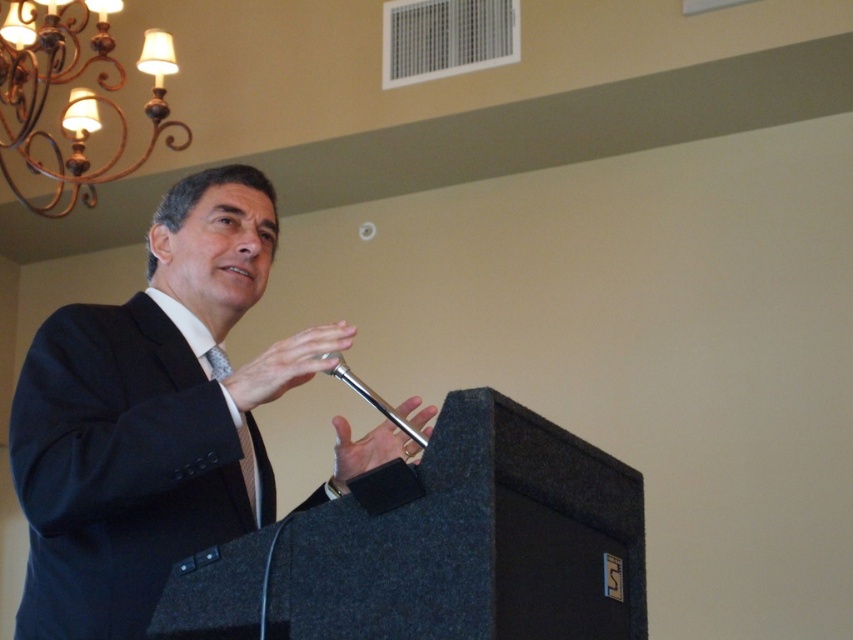
Does black suit at center have a greater height compared to gold wrought iron chandelier at upper left?

No, black suit at center is not taller than gold wrought iron chandelier at upper left.

Who is more forward, (39,540) or (190,131)?

Point (39,540)

Measure the distance between black suit at center and camera.

black suit at center is 5.14 feet from camera.

Where is `black suit at center`? The image size is (853, 640). black suit at center is located at coordinates (149, 416).

Does gold wrought iron chandelier at upper left lie in front of silver metallic microphone at center?

No.

Between point (32, 104) and point (347, 376), which one is positioned in front?

Point (347, 376) is in front.

At what (x,y) coordinates should I click in order to perform the action: click on gold wrought iron chandelier at upper left. Please return your answer as a coordinate pair (x, y). Looking at the image, I should click on (73, 92).

Is black suit at center bigger than silver metallic microphone at center?

Yes, black suit at center is bigger than silver metallic microphone at center.

Between black suit at center and silver metallic microphone at center, which one has less height?

With less height is silver metallic microphone at center.

This screenshot has height=640, width=853. What are the coordinates of `black suit at center` in the screenshot? It's located at (149, 416).

The width and height of the screenshot is (853, 640). I want to click on black suit at center, so click(x=149, y=416).